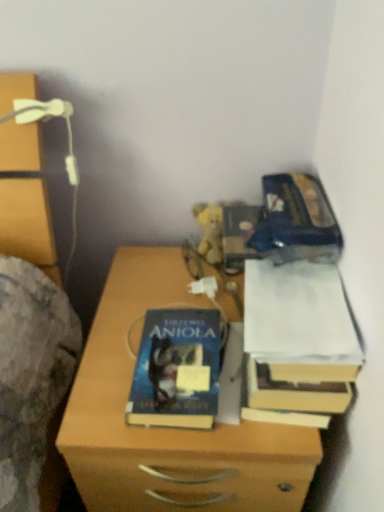
The width and height of the screenshot is (384, 512). Identify the location of free space above hardcover book at center (from a real-world perspective). coord(182,346).